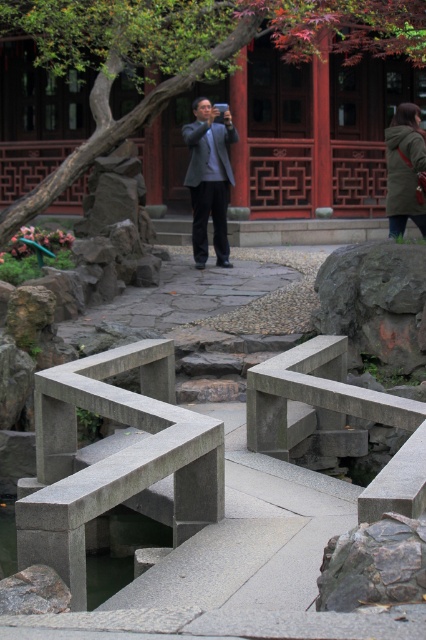
You are standing on the stone bridge and want to sit down. You see a gray stone bench at center and a smooth gray stone pond at center. Which object is located to the right side from your perspective?

The gray stone bench at center is to the right of the smooth gray stone pond at center, so the gray stone bench at center is located to the right side from your perspective.

You are a visitor in the garden and want to sit down. You see a gray stone bench at center and a matte gray suit at center. Which object can you sit on?

The gray stone bench at center is positioned under matte gray suit at center, so you can sit on the gray stone bench at center.

You are a visitor in this garden and want to take a photo of the green leafy tree at upper center and the matte gray suit at center. Which object should you zoom in more on to capture both in the frame?

Since the green leafy tree at upper center is smaller than the matte gray suit at center, you should zoom in more on the matte gray suit at center to ensure both fit in the frame.